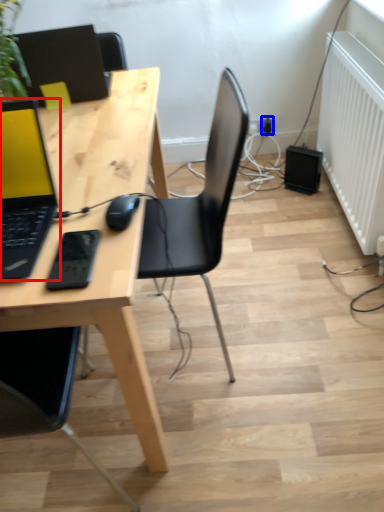
Question: Which of the following is the closest to the observer, laptop (highlighted by a red box) or electric outlet (highlighted by a blue box)?

Choices:
 (A) laptop
 (B) electric outlet

Answer: (A)